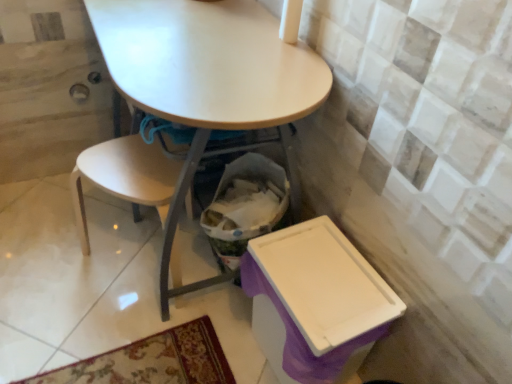
Question: Should I look upward or downward to see light wood chair at lower left?

Choices:
 (A) up
 (B) down

Answer: (B)

Question: Can you confirm if matte white table at center is shorter than light wood chair at lower left?

Choices:
 (A) yes
 (B) no

Answer: (B)

Question: Are matte white table at center and light wood chair at lower left far apart?

Choices:
 (A) yes
 (B) no

Answer: (B)

Question: Does matte white table at center lie behind light wood chair at lower left?

Choices:
 (A) yes
 (B) no

Answer: (B)

Question: Can you confirm if matte white table at center is positioned to the right of light wood chair at lower left?

Choices:
 (A) yes
 (B) no

Answer: (A)

Question: Is matte white table at center smaller than light wood chair at lower left?

Choices:
 (A) no
 (B) yes

Answer: (A)

Question: Does matte white table at center have a greater width compared to light wood chair at lower left?

Choices:
 (A) no
 (B) yes

Answer: (B)

Question: From a real-world perspective, is purple plastic box at lower right located higher than light wood chair at lower left?

Choices:
 (A) no
 (B) yes

Answer: (A)

Question: Is light wood chair at lower left a part of purple plastic box at lower right?

Choices:
 (A) no
 (B) yes

Answer: (A)

Question: From a real-world perspective, is purple plastic box at lower right below light wood chair at lower left?

Choices:
 (A) yes
 (B) no

Answer: (A)

Question: Is purple plastic box at lower right bigger than light wood chair at lower left?

Choices:
 (A) no
 (B) yes

Answer: (A)

Question: Are purple plastic box at lower right and light wood chair at lower left far apart?

Choices:
 (A) no
 (B) yes

Answer: (A)

Question: Is purple plastic box at lower right positioned behind light wood chair at lower left?

Choices:
 (A) no
 (B) yes

Answer: (A)

Question: Is matte white table at center oriented away from purple plastic box at lower right?

Choices:
 (A) yes
 (B) no

Answer: (B)